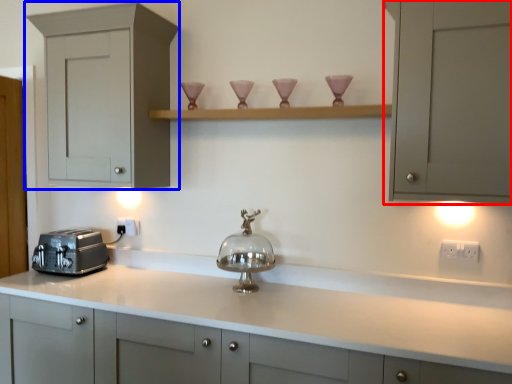
Question: Which point is further to the camera, cabinetry (highlighted by a red box) or cabinetry (highlighted by a blue box)?

Choices:
 (A) cabinetry
 (B) cabinetry

Answer: (B)